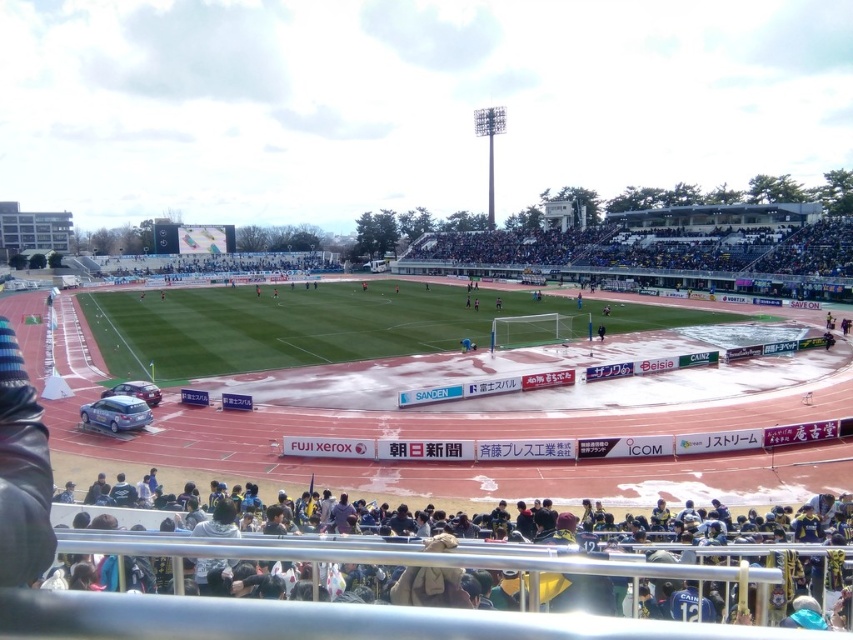
You are a photographer positioned at the edge of the stadium, aiming to capture a shot of the dark blue fabric at lower center and the satin silver car at lower left. Based on their positions, which object is closer to the right side of your frame?

The dark blue fabric at lower center is to the right of the satin silver car at lower left, so the dark blue fabric at lower center is closer to the right side of the frame.

In the scene shown: You are a spectator at the stadium and want to park your car. You see a satin blue sedan at lower left and a satin silver car at lower left. Which car is closer to the entrance of the parking area?

The satin blue sedan at lower left is closer to the entrance of the parking area because it is in front of the satin silver car at lower left.

You are a photographer positioned at the center of the soccer field. You want to take a photo of the satin blue sedan at lower left. In which direction should you move to frame it in your camera?

You should move towards the lower left direction to frame the satin blue sedan at lower left in your camera since it is located at point (115, 413), which is the lower left position.